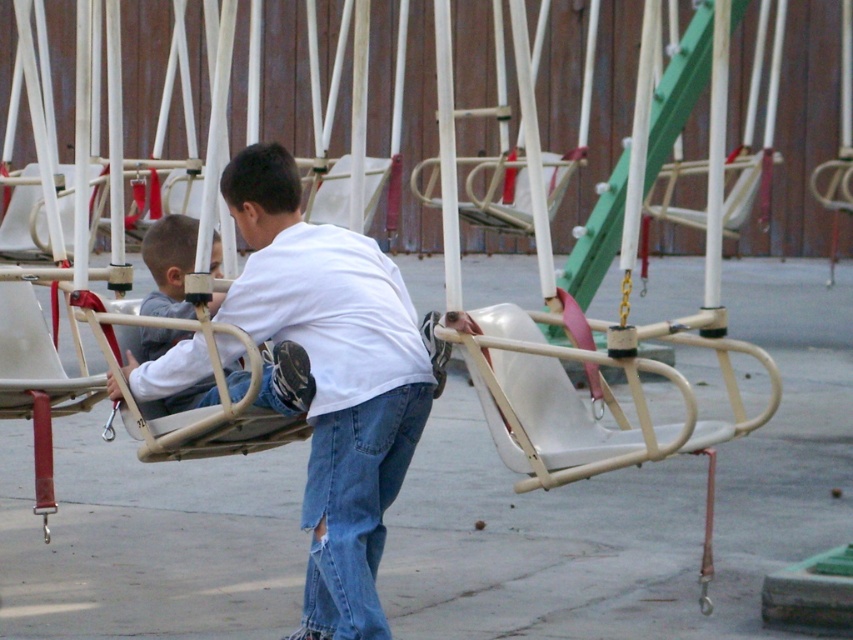
You are observing two children at a playground. You notice a white matte shirt at center and a denim at center. Which clothing item is positioned to the left?

The white matte shirt at center is to the left of denim at center, so the white matte shirt at center is positioned to the left.

You are a photographer trying to capture a candid shot of the two children at the playground. The white matte shirt at center and denim at center are both in your viewfinder. Which piece of clothing should you focus on if you want to ensure it takes up more space in the photo?

The white matte shirt at center has a larger size compared to denim at center, so focusing on the white matte shirt at center will ensure it takes up more space in the photo.

You are standing at the point labeled point [189,236] and want to walk to the point labeled point [189,365]. Which direction should you go?

You should walk forward because point [189,365] is in front of point [189,236].